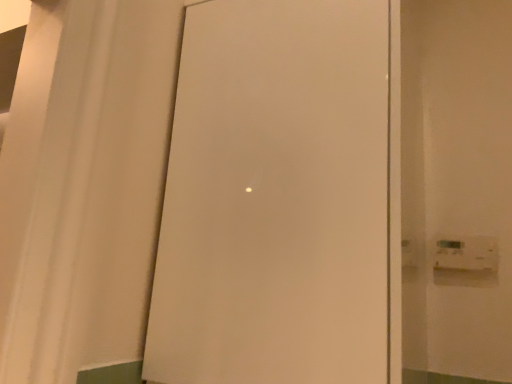
Question: Considering the positions of point (257, 235) and point (489, 256), is point (257, 235) closer or farther from the camera than point (489, 256)?

Choices:
 (A) closer
 (B) farther

Answer: (A)

Question: Would you say white matte door at center is to the left or to the right of white plastic light switch at right in the picture?

Choices:
 (A) left
 (B) right

Answer: (A)

Question: Considering the positions of white matte door at center and white plastic light switch at right in the image, is white matte door at center taller or shorter than white plastic light switch at right?

Choices:
 (A) short
 (B) tall

Answer: (B)

Question: Is white plastic light switch at right inside the boundaries of white matte door at center, or outside?

Choices:
 (A) inside
 (B) outside

Answer: (B)

Question: Is white plastic light switch at right in front of or behind white matte door at center in the image?

Choices:
 (A) front
 (B) behind

Answer: (B)

Question: Is point (442, 261) positioned closer to the camera than point (230, 44)?

Choices:
 (A) closer
 (B) farther

Answer: (B)

Question: From the image's perspective, is white plastic light switch at right above or below white matte door at center?

Choices:
 (A) above
 (B) below

Answer: (B)